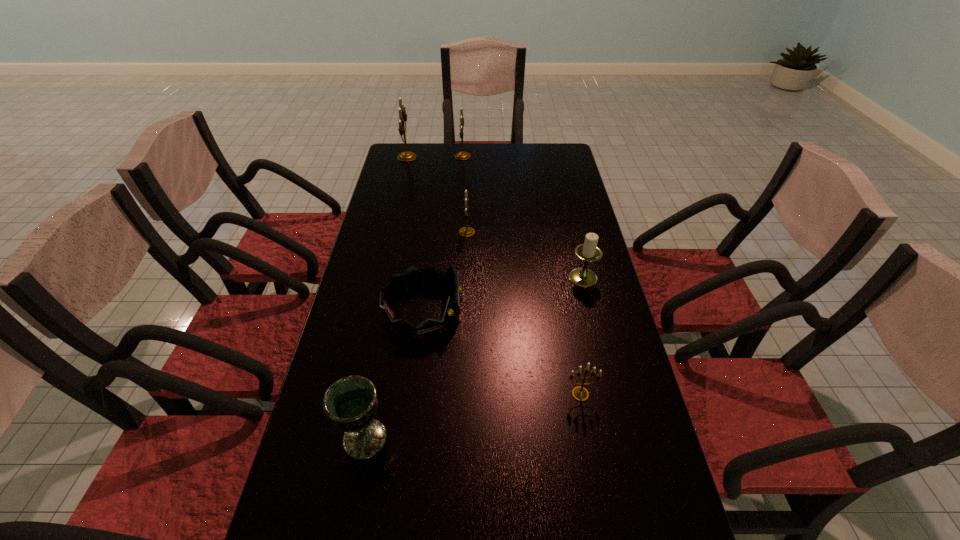
Where is `free spot between the second biggest gold candelabrum and the tiara`? The height and width of the screenshot is (540, 960). free spot between the second biggest gold candelabrum and the tiara is located at coordinates (443, 234).

You are a GUI agent. You are given a task and a screenshot of the screen. Output one action in this format:
    pyautogui.click(x=<x>, y=<y>)
    Task: Click on the free point between the white candle holder and the nearest object
    The width and height of the screenshot is (960, 540).
    Given the screenshot: What is the action you would take?
    pyautogui.click(x=474, y=358)

Identify the location of vacant region between the red tiara and the leftmost candelabrum. The width and height of the screenshot is (960, 540). pyautogui.click(x=415, y=234).

Where is `unoccupied area between the tiara and the biggest gold candelabrum`? unoccupied area between the tiara and the biggest gold candelabrum is located at coordinates (415, 234).

Find the location of a particular element. The height and width of the screenshot is (540, 960). the fifth closest object to the white candle holder is located at coordinates (462, 155).

Locate which object is the fifth closest to the fifth nearest object. Please provide its 2D coordinates. Your answer should be formatted as a tuple, i.e. [(x, y)], where the tuple contains the x and y coordinates of a point satisfying the conditions above.

[(579, 393)]

Select which candelabrum appears as the second closest to the tallest candelabrum. Please provide its 2D coordinates. Your answer should be formatted as a tuple, i.e. [(x, y)], where the tuple contains the x and y coordinates of a point satisfying the conditions above.

[(466, 231)]

Locate which candelabrum is the closest to the white candle holder. Please provide its 2D coordinates. Your answer should be formatted as a tuple, i.e. [(x, y)], where the tuple contains the x and y coordinates of a point satisfying the conditions above.

[(466, 231)]

Select which gold candelabrum is the closest to the red tiara. Please provide its 2D coordinates. Your answer should be formatted as a tuple, i.e. [(x, y)], where the tuple contains the x and y coordinates of a point satisfying the conditions above.

[(466, 231)]

Identify which gold candelabrum is the second closest to the chalice. Please provide its 2D coordinates. Your answer should be formatted as a tuple, i.e. [(x, y)], where the tuple contains the x and y coordinates of a point satisfying the conditions above.

[(466, 231)]